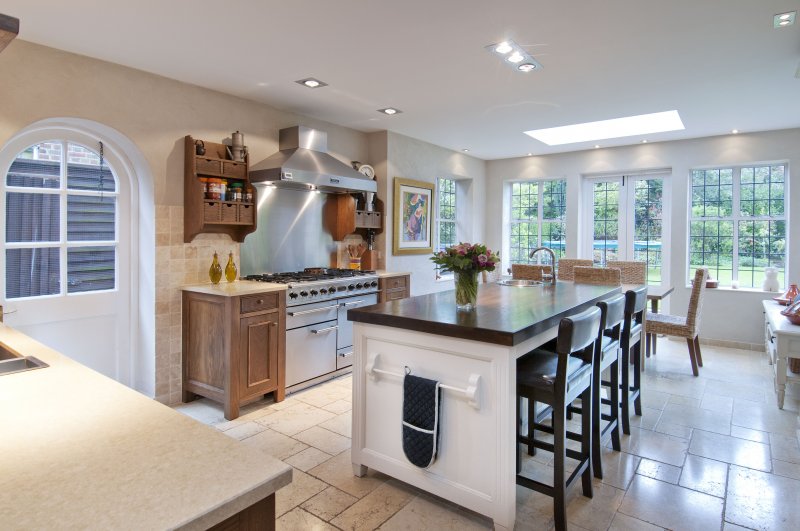
Identify the location of windows. (610, 199), (717, 203).